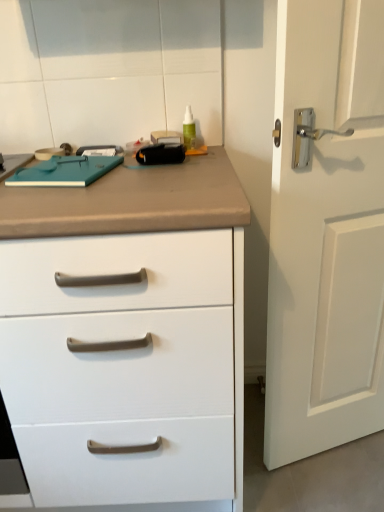
Find the location of a particular element. The width and height of the screenshot is (384, 512). white matte chest of drawers at center is located at coordinates (127, 334).

The image size is (384, 512). Describe the element at coordinates (127, 334) in the screenshot. I see `white matte chest of drawers at center` at that location.

In order to face white matte chest of drawers at center, should I rotate leftwards or rightwards?

Turn left approximately 15.201 degrees to face it.

What do you see at coordinates (326, 233) in the screenshot?
I see `white matte door at right` at bounding box center [326, 233].

This screenshot has width=384, height=512. In order to click on white matte door at right in this screenshot , I will do click(x=326, y=233).

Measure the distance between white matte door at right and camera.

30.68 inches.

The width and height of the screenshot is (384, 512). I want to click on white matte chest of drawers at center, so click(x=127, y=334).

Can you confirm if white matte door at right is positioned to the right of white matte chest of drawers at center?

Indeed, white matte door at right is positioned on the right side of white matte chest of drawers at center.

Consider the image. Which object is closer to the camera, white matte door at right or white matte chest of drawers at center?

white matte chest of drawers at center is more forward.

Is point (280, 207) positioned in front of point (161, 271)?

No, (280, 207) is behind (161, 271).

From the image's perspective, is white matte door at right located above or below white matte chest of drawers at center?

From the image's perspective, white matte door at right appears above white matte chest of drawers at center.

From a real-world perspective, which is physically below, white matte door at right or white matte chest of drawers at center?

white matte chest of drawers at center.

In terms of width, does white matte door at right look wider or thinner when compared to white matte chest of drawers at center?

white matte door at right is thinner than white matte chest of drawers at center.

Which of these two, white matte door at right or white matte chest of drawers at center, stands shorter?

white matte chest of drawers at center is shorter.

Can you confirm if white matte door at right is bigger than white matte chest of drawers at center?

Incorrect, white matte door at right is not larger than white matte chest of drawers at center.

Would you say white matte chest of drawers at center is part of white matte door at right's contents?

Actually, white matte chest of drawers at center is outside white matte door at right.

Is white matte door at right not near white matte chest of drawers at center?

No, white matte door at right is not far from white matte chest of drawers at center.

Could you tell me if white matte door at right is facing white matte chest of drawers at center?

No, white matte door at right is not facing towards white matte chest of drawers at center.

Image resolution: width=384 pixels, height=512 pixels. I want to click on door that appears behind the white matte chest of drawers at center, so click(326, 233).

Considering the positions of objects white matte chest of drawers at center and white matte door at right in the image provided, who is more to the right, white matte chest of drawers at center or white matte door at right?

white matte door at right is more to the right.

Does white matte chest of drawers at center lie behind white matte door at right?

No, it is in front of white matte door at right.

Considering the points (27, 294) and (377, 137), which point is in front, point (27, 294) or point (377, 137)?

The point (27, 294) is more forward.

From the image's perspective, which is above, white matte chest of drawers at center or white matte door at right?

white matte door at right is shown above in the image.

From a real-world perspective, is white matte chest of drawers at center above or below white matte door at right?

In terms of real-world spatial position, white matte chest of drawers at center is below white matte door at right.

Based on the photo, is white matte chest of drawers at center thinner than white matte door at right?

No, white matte chest of drawers at center is not thinner than white matte door at right.

Considering the relative sizes of white matte chest of drawers at center and white matte door at right in the image provided, is white matte chest of drawers at center taller than white matte door at right?

Incorrect, the height of white matte chest of drawers at center is not larger of that of white matte door at right.

Considering the relative sizes of white matte chest of drawers at center and white matte door at right in the image provided, is white matte chest of drawers at center bigger than white matte door at right?

Correct, white matte chest of drawers at center is larger in size than white matte door at right.

Is white matte chest of drawers at center inside or outside of white matte door at right?

white matte chest of drawers at center cannot be found inside white matte door at right.

Is white matte chest of drawers at center next to white matte door at right?

white matte chest of drawers at center is not next to white matte door at right, and they're not touching.

Could you tell me if white matte chest of drawers at center is turned towards white matte door at right?

No, white matte chest of drawers at center is not aimed at white matte door at right.

Can you tell me how much white matte chest of drawers at center and white matte door at right differ in facing direction?

There is a 18.7-degree angle between the facing directions of white matte chest of drawers at center and white matte door at right.

The image size is (384, 512). I want to click on door on the right of white matte chest of drawers at center, so click(x=326, y=233).

There is a white matte chest of drawers at center. Identify the location of door above it (from a real-world perspective). The image size is (384, 512). (326, 233).

Locate an element on the screen. door behind the white matte chest of drawers at center is located at coordinates (326, 233).